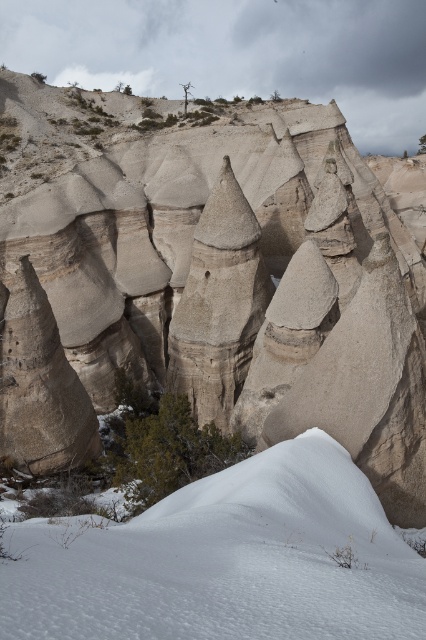
Based on the photo, you are an explorer standing at the edge of this snowfield. You see the smooth sandstone rock formation at center and the white fluffy snow at lower center. Which object is taller?

The smooth sandstone rock formation at center is taller than the white fluffy snow at lower center.

You are an explorer standing at the edge of the snowfield. You see the smooth sandstone rock formation at center and the white fluffy snow at lower center. Which object is closer to you?

The white fluffy snow at lower center is closer to you because it is positioned under the smooth sandstone rock formation at center.

You are standing at the origin point of the coordinate system in the image. You want to reach the smooth sandstone rock formation at center. Which direction should you move in to get there?

The smooth sandstone rock formation at center is located at coordinate point [224,266], so you should move northeast to reach it.